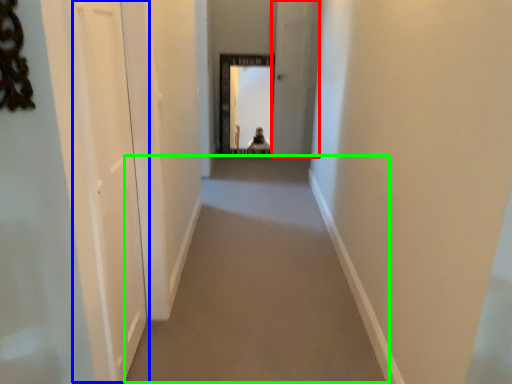
Question: Considering the real-world distances, which object is farthest from screen door (highlighted by a red box)? screen door (highlighted by a blue box) or corridor (highlighted by a green box)?

Choices:
 (A) screen door
 (B) corridor

Answer: (A)